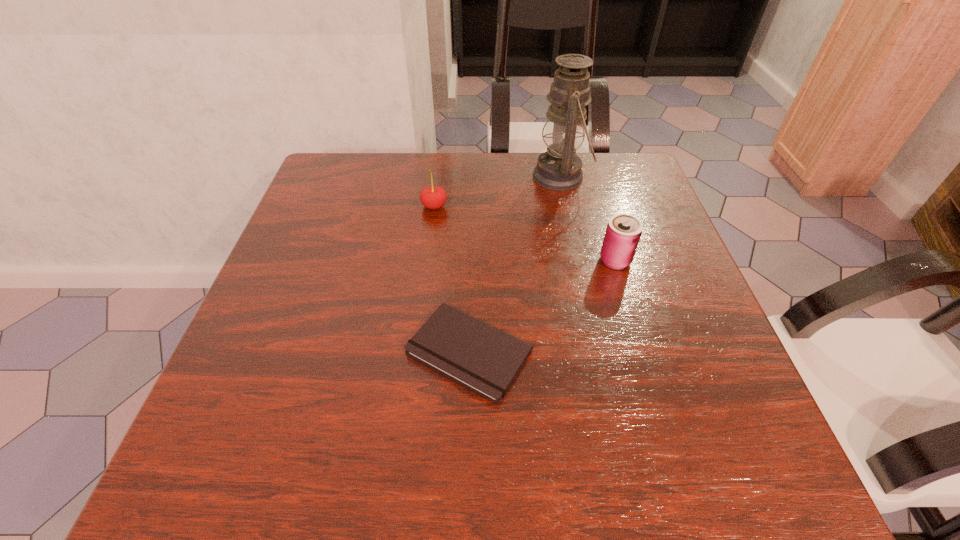
Find the location of `cherry located in the far edge section of the desktop`. cherry located in the far edge section of the desktop is located at coordinates (433, 197).

Where is `oil lamp at the right edge`? This screenshot has height=540, width=960. oil lamp at the right edge is located at coordinates (559, 168).

Identify the location of can present at the right edge. This screenshot has width=960, height=540. (623, 232).

What are the coordinates of `object that is at the far right corner` in the screenshot? It's located at (559, 168).

In the image, there is a desktop. Where is `vacant space at the far edge`? vacant space at the far edge is located at coordinates [408, 172].

In the image, there is a desktop. Identify the location of blank space at the left edge. The height and width of the screenshot is (540, 960). (272, 328).

Locate an element on the screen. blank space at the right edge is located at coordinates (633, 214).

In the image, there is a desktop. At what (x,y) coordinates should I click in order to perform the action: click on free space at the far left corner. Please return your answer as a coordinate pair (x, y). The width and height of the screenshot is (960, 540). Looking at the image, I should click on pos(312,197).

Find the location of a particular element. vacant space at the far right corner of the desktop is located at coordinates (604, 194).

At what (x,y) coordinates should I click in order to perform the action: click on unoccupied area between the tallest object and the nearest object. Please return your answer as a coordinate pair (x, y). Looking at the image, I should click on (515, 264).